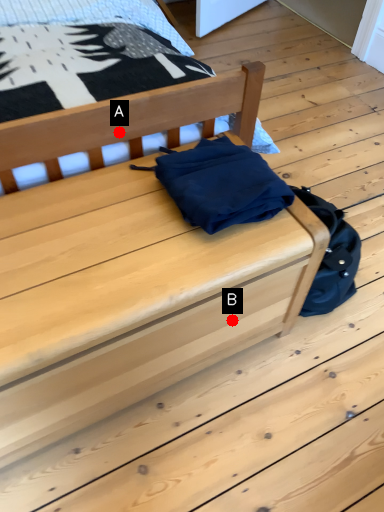
Question: Two points are circled on the image, labeled by A and B beside each circle. Which point is closer to the camera?

Choices:
 (A) A is closer
 (B) B is closer

Answer: (B)